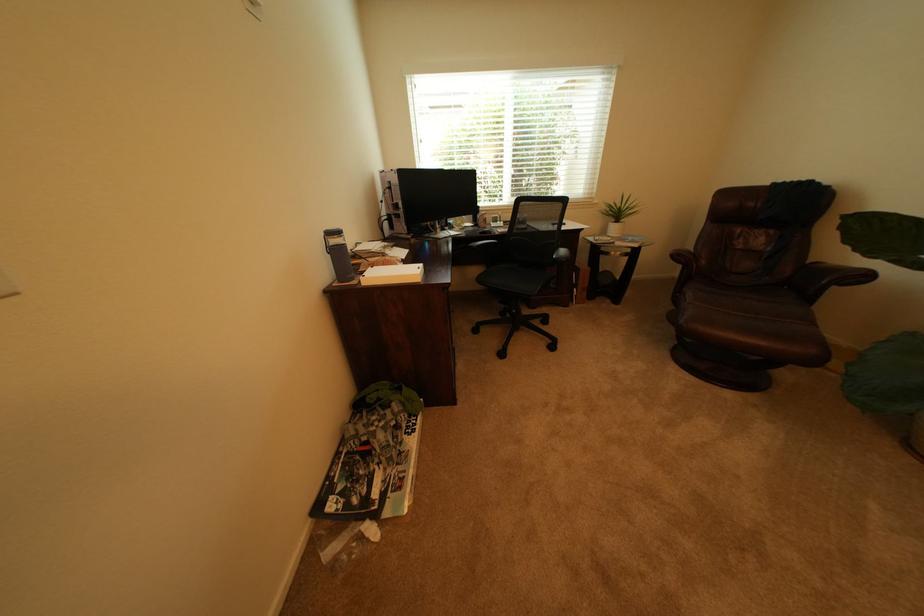
You are a GUI agent. You are given a task and a screenshot of the screen. Output one action in this format:
    pyautogui.click(x=<x>, y=<y>)
    Task: Click on the brown recliner armrest
    This screenshot has height=616, width=924.
    Given the screenshot: What is the action you would take?
    pyautogui.click(x=836, y=275)